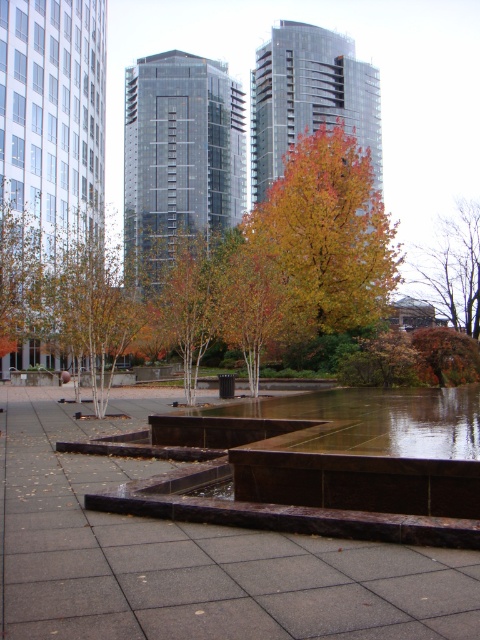
Does autumn leaves tree at center have a lesser height compared to autumn leaves at center?

Incorrect, autumn leaves tree at center's height does not fall short of autumn leaves at center's.

Is autumn leaves tree at center above autumn leaves at center?

No.

What do you see at coordinates (327, 236) in the screenshot? The image size is (480, 640). I see `autumn leaves tree at center` at bounding box center [327, 236].

Locate an element on the screen. This screenshot has width=480, height=640. autumn leaves tree at center is located at coordinates (327, 236).

Between dark gray concrete pavement at center and autumn leaves tree at center, which one has more height?

autumn leaves tree at center

Between dark gray concrete pavement at center and autumn leaves tree at center, which one is positioned lower?

dark gray concrete pavement at center is lower down.

In order to click on dark gray concrete pavement at center in this screenshot , I will do `click(190, 554)`.

Is dark gray concrete pavement at center thinner than glossy concrete puddle at center?

No.

Between dark gray concrete pavement at center and glossy concrete puddle at center, which one has more height?

With more height is dark gray concrete pavement at center.

Between point (218, 621) and point (215, 488), which one is positioned behind?

Positioned behind is point (215, 488).

Locate an element on the screen. This screenshot has width=480, height=640. dark gray concrete pavement at center is located at coordinates (190, 554).